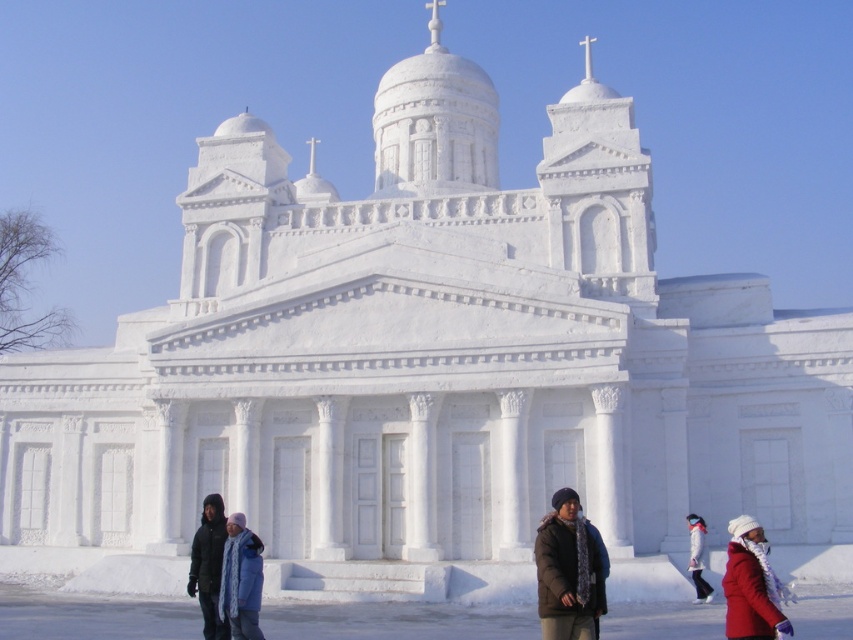
Question: Is dark brown fur coat at center smaller than light blue fabric coat at lower center?

Choices:
 (A) yes
 (B) no

Answer: (B)

Question: Which object is closer to the camera taking this photo?

Choices:
 (A) dark gray jacket at lower left
 (B) white woolen hat at lower right

Answer: (A)

Question: Can you confirm if dark gray jacket at lower left is positioned to the left of white woolen hat at lower right?

Choices:
 (A) yes
 (B) no

Answer: (A)

Question: Which object appears farthest from the camera in this image?

Choices:
 (A) light blue fabric coat at lower center
 (B) white woolen hat at lower right
 (C) dark brown fur coat at center

Answer: (B)

Question: Which point is farther to the camera?

Choices:
 (A) (199, 557)
 (B) (241, 550)
 (C) (566, 627)

Answer: (A)

Question: Can you confirm if dark brown fur coat at center is positioned to the left of white woolen hat at lower right?

Choices:
 (A) yes
 (B) no

Answer: (A)